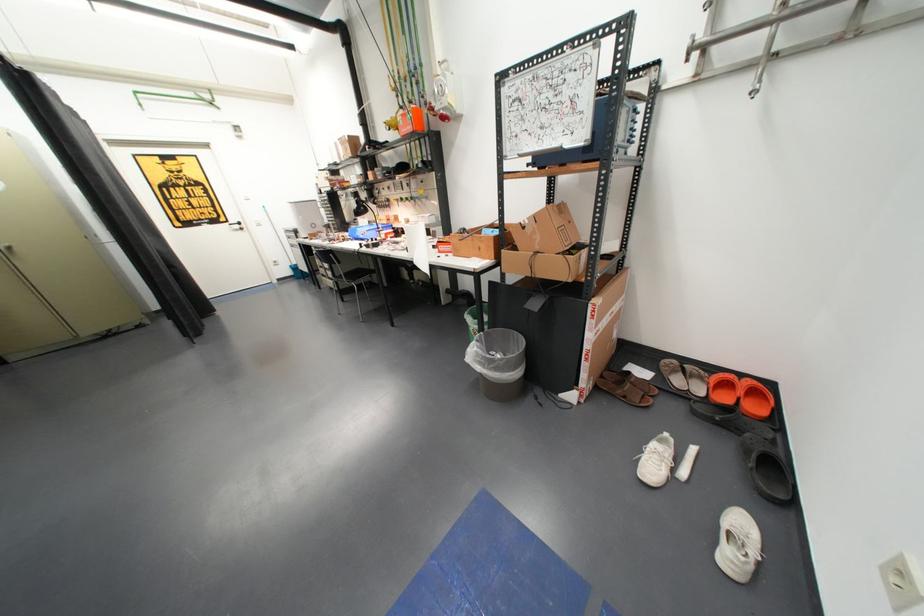
Describe the element at coordinates (235, 225) in the screenshot. I see `the white door handle` at that location.